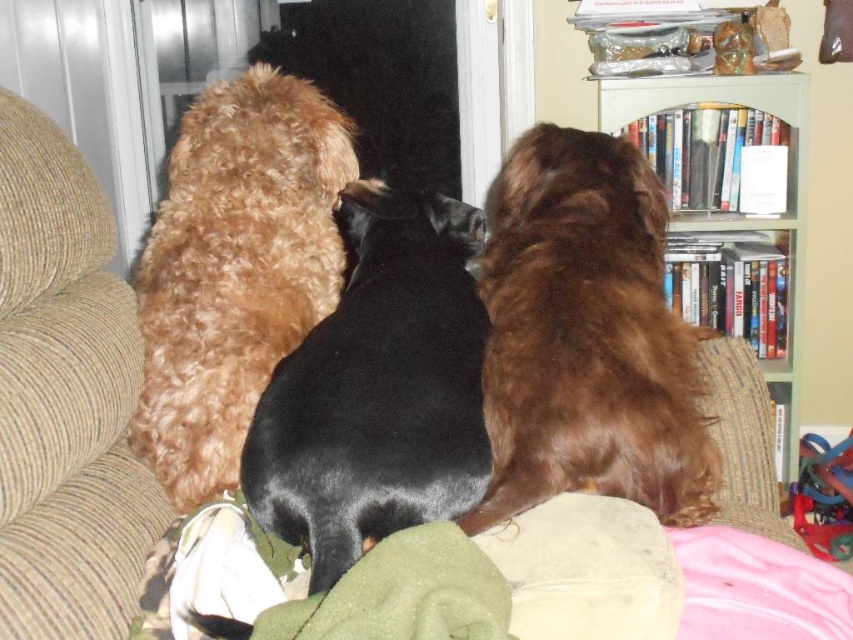
Between beige corduroy couch at left and green painted wood bookshelf at upper right, which one appears on the left side from the viewer's perspective?

beige corduroy couch at left is more to the left.

Is beige corduroy couch at left wider than green painted wood bookshelf at upper right?

No.

Identify the location of beige corduroy couch at left. (65, 397).

At what (x,y) coordinates should I click in order to perform the action: click on beige corduroy couch at left. Please return your answer as a coordinate pair (x, y). Looking at the image, I should click on (65, 397).

Who is taller, beige corduroy couch at left or shaggy golden-brown dog at center?

Standing taller between the two is beige corduroy couch at left.

Between beige corduroy couch at left and shaggy golden-brown dog at center, which one appears on the left side from the viewer's perspective?

beige corduroy couch at left is more to the left.

Which is in front, point (120, 506) or point (175, 292)?

Positioned in front is point (120, 506).

Locate an element on the screen. This screenshot has width=853, height=640. beige corduroy couch at left is located at coordinates (65, 397).

Is brown fluffy dog at right positioned behind green painted wood bookshelf at upper right?

No, brown fluffy dog at right is in front of green painted wood bookshelf at upper right.

Can you confirm if brown fluffy dog at right is positioned to the right of green painted wood bookshelf at upper right?

Incorrect, brown fluffy dog at right is not on the right side of green painted wood bookshelf at upper right.

Where is `brown fluffy dog at right`? This screenshot has width=853, height=640. brown fluffy dog at right is located at coordinates (585, 337).